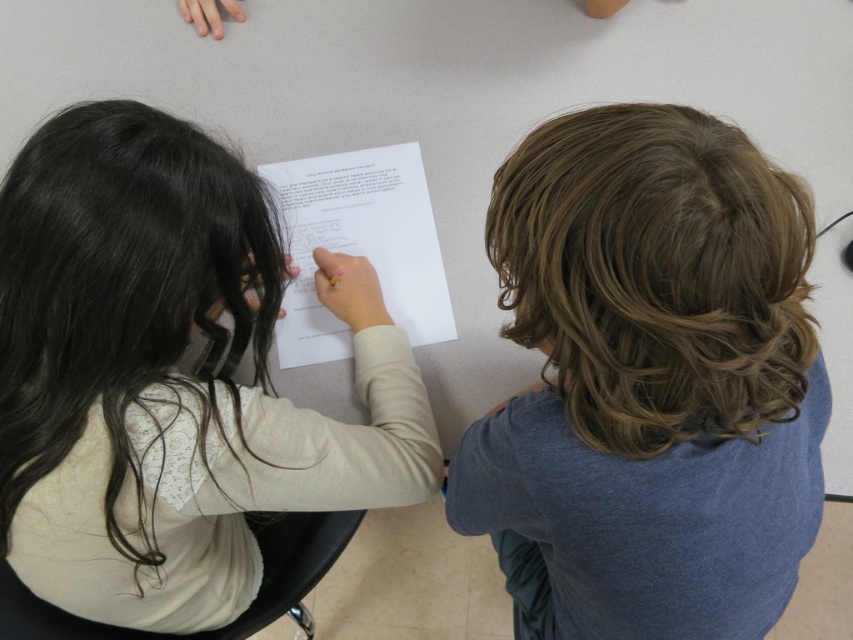
Is light beige lace shirt at center smaller than white paper at center?

Incorrect, light beige lace shirt at center is not smaller in size than white paper at center.

The width and height of the screenshot is (853, 640). I want to click on light beige lace shirt at center, so click(x=170, y=376).

Is smooth brown hair at center positioned behind light beige lace shirt at center?

That is False.

Which is behind, point (535, 291) or point (166, 381)?

Point (166, 381)

Where is `smooth brown hair at center`? This screenshot has width=853, height=640. smooth brown hair at center is located at coordinates [x=648, y=381].

Between smooth brown hair at center and white paper at center, which one appears on the left side from the viewer's perspective?

Positioned to the left is white paper at center.

Does smooth brown hair at center appear on the right side of white paper at center?

Yes, smooth brown hair at center is to the right of white paper at center.

Between point (606, 532) and point (392, 241), which one is positioned behind?

The point (392, 241) is more distant.

I want to click on smooth brown hair at center, so click(x=648, y=381).